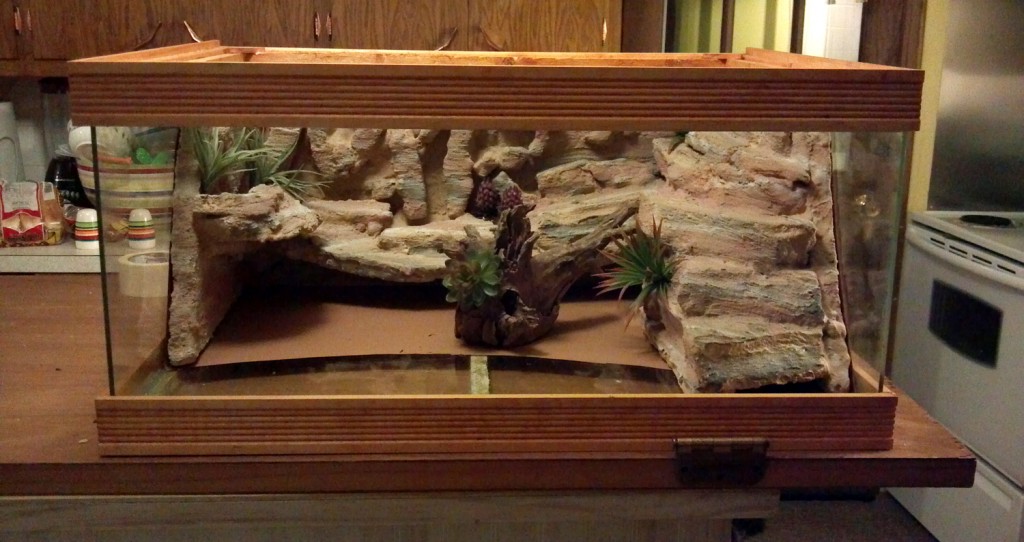
The image size is (1024, 542). What are the coordinates of `glass pane` in the screenshot? It's located at (353, 245), (122, 259), (870, 229).